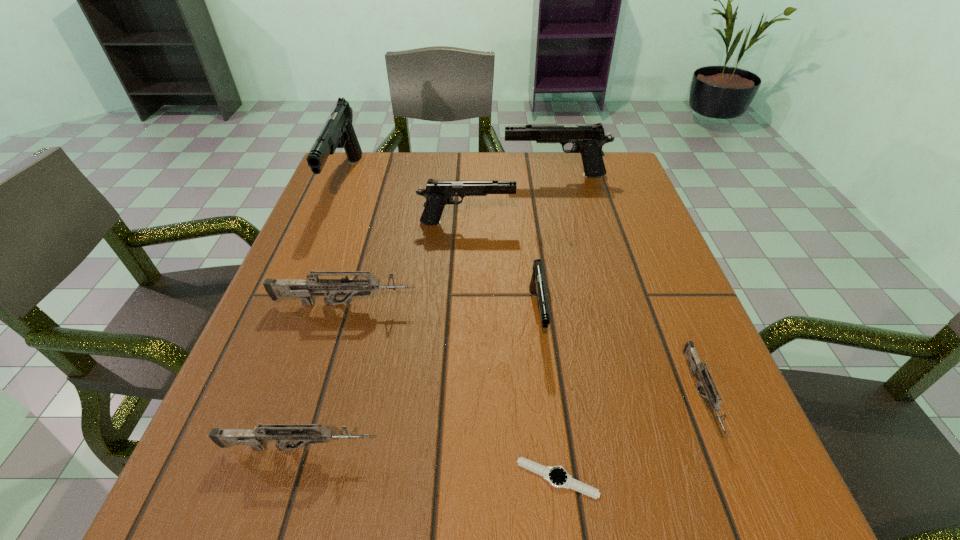
Identify the location of grey gun that is the closest to the shortest gun. (303, 288).